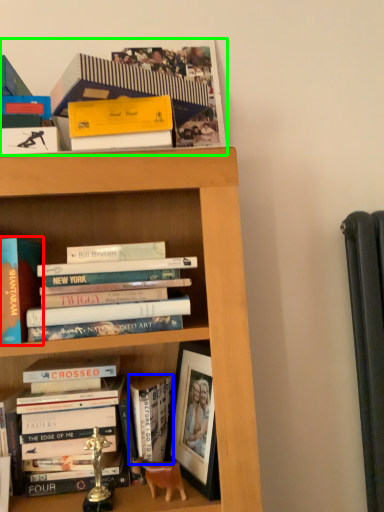
Question: Based on their relative distances, which object is nearer to book (highlighted by a red box)? Choose from book (highlighted by a blue box) and book (highlighted by a green box).

Choices:
 (A) book
 (B) book

Answer: (A)